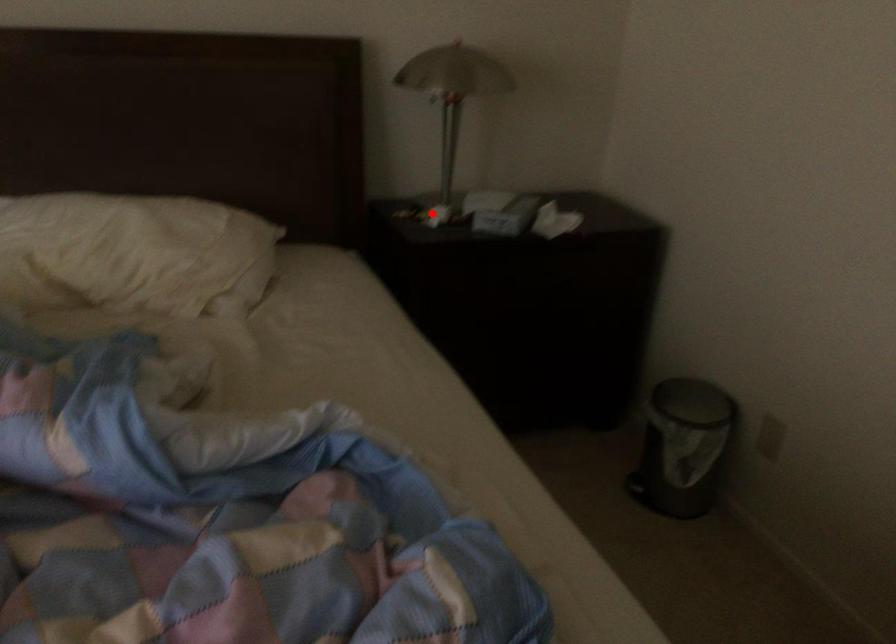
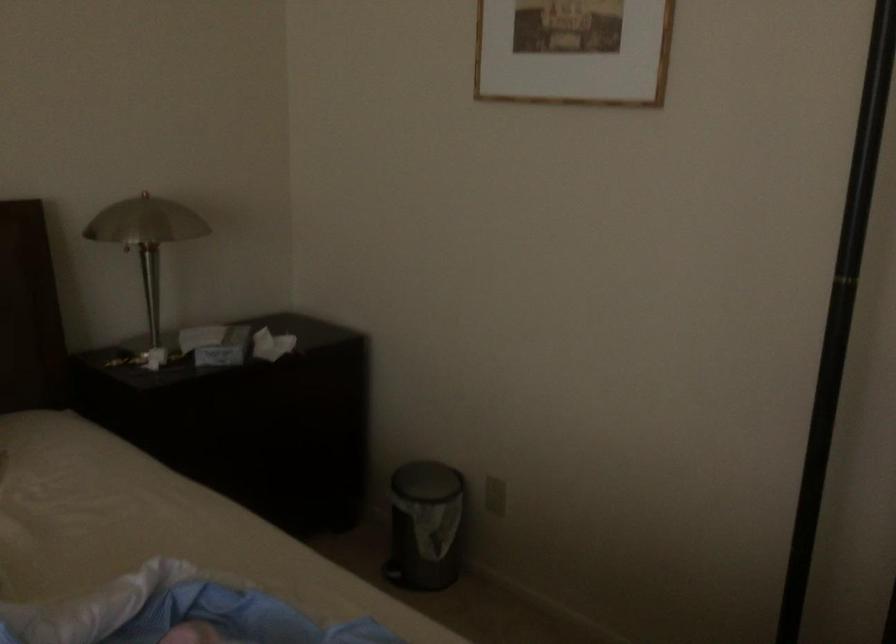
The point at the highlighted location is marked in the first image. Where is the corresponding point in the second image?

(151, 357)